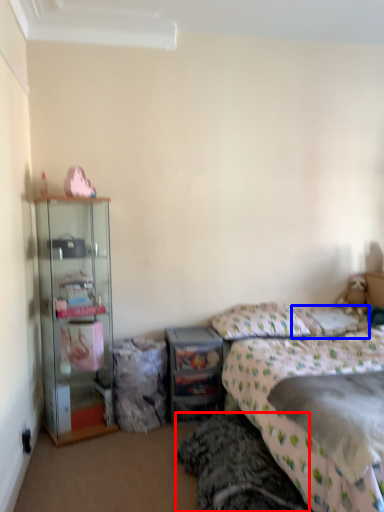
Question: Which of the following is the closest to the observer, bed frame (highlighted by a red box) or pillow (highlighted by a blue box)?

Choices:
 (A) bed frame
 (B) pillow

Answer: (A)